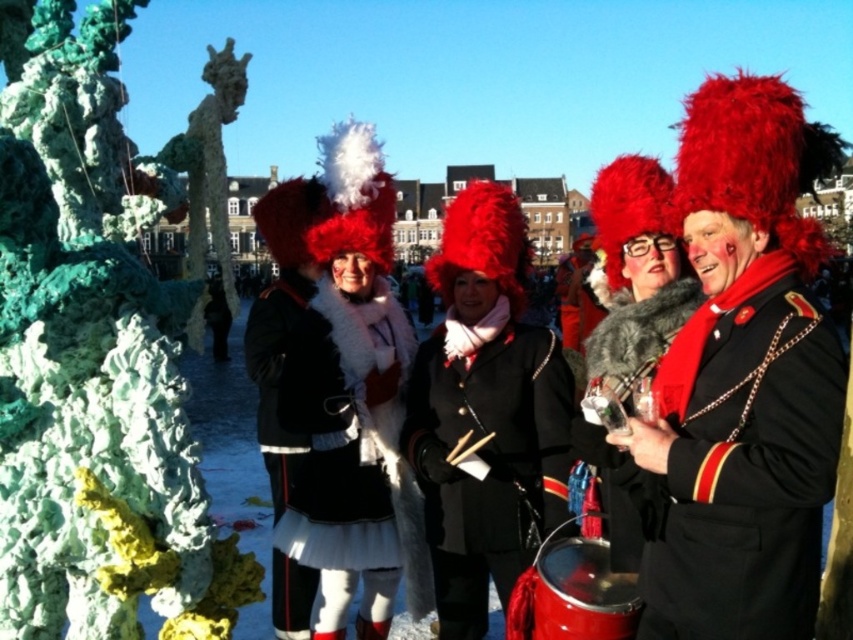
Question: Is white fur coat at center bigger than fuzzy fur coat at center?

Choices:
 (A) no
 (B) yes

Answer: (A)

Question: Which of the following is the farthest from the observer?

Choices:
 (A) (364, 467)
 (B) (601, 637)
 (C) (799, 554)

Answer: (A)

Question: Is velvet red hat at center closer to camera compared to fuzzy fur coat at center?

Choices:
 (A) yes
 (B) no

Answer: (B)

Question: Is fuzzy fur coat at center to the left of shiny red drum at lower center from the viewer's perspective?

Choices:
 (A) yes
 (B) no

Answer: (B)

Question: Which object is positioned closest to the fuzzy fur coat at center?

Choices:
 (A) velvet red coat at right
 (B) velvet red hat at center
 (C) white fur coat at center
 (D) shiny red drum at lower center

Answer: (A)

Question: Which of the following is the farthest from the observer?

Choices:
 (A) fuzzy fur coat at center
 (B) velvet red hat at center
 (C) velvet red coat at right
 (D) white fur coat at center

Answer: (D)